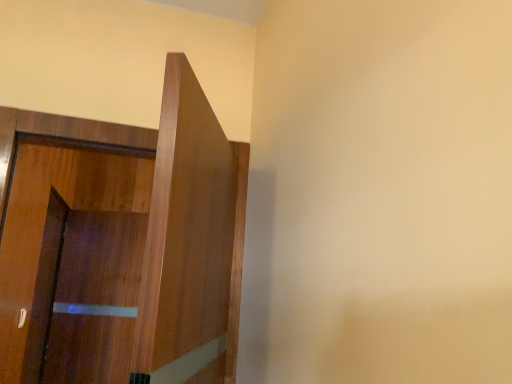
Question: Is point (128, 372) closer or farther from the camera than point (6, 188)?

Choices:
 (A) farther
 (B) closer

Answer: (A)

Question: From a real-world perspective, is brown wood screen door at left positioned above or below wooden door at left?

Choices:
 (A) above
 (B) below

Answer: (B)

Question: Based on their sizes in the image, would you say brown wood screen door at left is bigger or smaller than wooden door at left?

Choices:
 (A) big
 (B) small

Answer: (B)

Question: Based on their positions, is wooden door at left located to the left or right of brown wood screen door at left?

Choices:
 (A) right
 (B) left

Answer: (A)

Question: Considering their positions, is wooden door at left located in front of or behind brown wood screen door at left?

Choices:
 (A) behind
 (B) front

Answer: (B)

Question: Considering the positions of point (99, 225) and point (111, 279), is point (99, 225) closer or farther from the camera than point (111, 279)?

Choices:
 (A) closer
 (B) farther

Answer: (B)

Question: From a real-world perspective, is wooden door at left above or below brown wood screen door at left?

Choices:
 (A) above
 (B) below

Answer: (A)